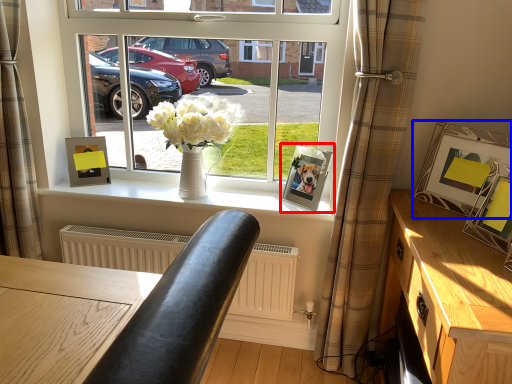
Question: Which object appears closest to the camera in this image, picture frame (highlighted by a red box) or picture frame (highlighted by a blue box)?

Choices:
 (A) picture frame
 (B) picture frame

Answer: (B)